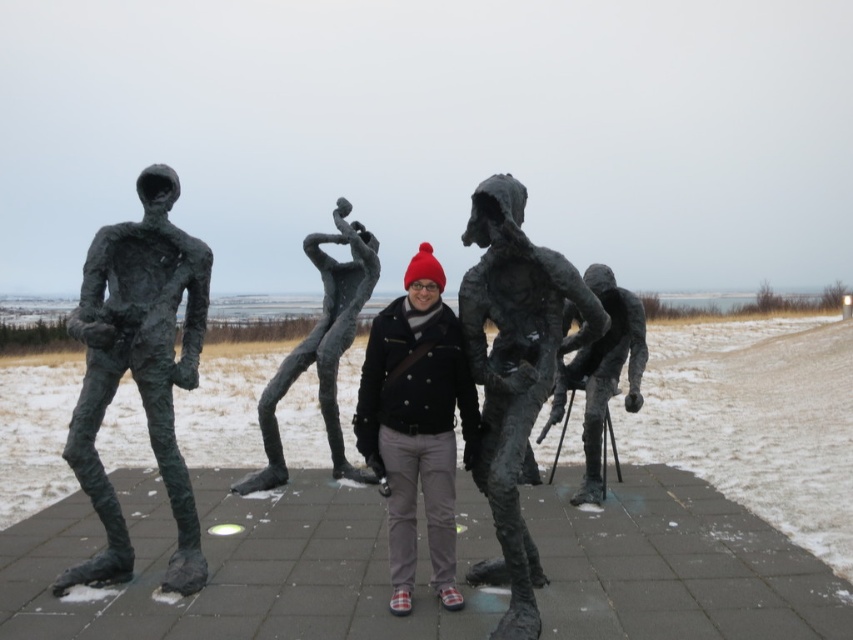
You are a photographer trying to capture a photo of the bronze textured figure at left and the matte black jacket at center. Which object will appear larger in the photo?

The bronze textured figure at left will appear larger in the photo because it is closer to the viewer than the matte black jacket at center.

You are a photographer trying to capture a shot of the bronze textured figure at left and the bronze sculpture at center. From your current position, which sculpture is positioned to the left of the other?

The bronze textured figure at left is to the left of the bronze sculpture at center.